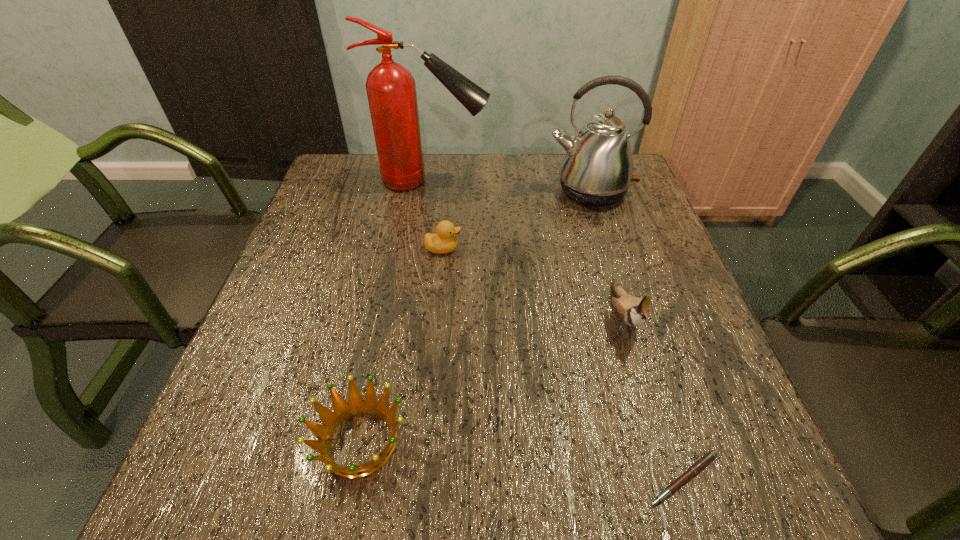
Locate an element on the screen. The image size is (960, 540). vacant position in the image that satisfies the following two spatial constraints: 1. at the nozzle end of the tallest object; 2. on the front side of the crown is located at coordinates (394, 441).

Locate an element on the screen. free space that satisfies the following two spatial constraints: 1. on the back side of the kettle; 2. at the nozzle end of the fire extinguisher is located at coordinates (587, 181).